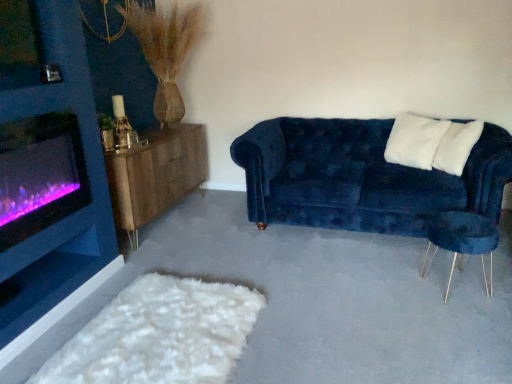
Identify the location of free space that is in between velvet blue couch at right and velvet blue armchair at right. (379, 257).